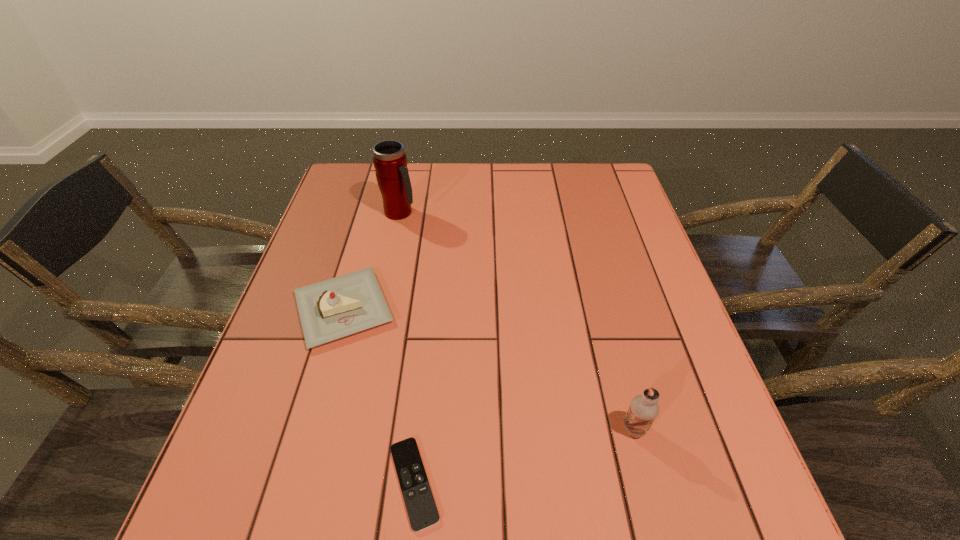
I want to click on vacant space positioned on the front of the third tallest object, so click(299, 465).

Where is `free space located 0.120m on the right of the remote control`? The height and width of the screenshot is (540, 960). free space located 0.120m on the right of the remote control is located at coordinates (512, 483).

Identify the location of object that is positioned at the far edge. This screenshot has height=540, width=960. (390, 162).

Identify the location of object that is at the near edge. The height and width of the screenshot is (540, 960). (422, 511).

Locate an element on the screen. object at the left edge is located at coordinates (338, 307).

Locate an element on the screen. Image resolution: width=960 pixels, height=540 pixels. object present at the right edge is located at coordinates click(x=643, y=409).

Locate an element on the screen. free space at the far edge of the desktop is located at coordinates (433, 186).

You are a GUI agent. You are given a task and a screenshot of the screen. Output one action in this format:
    pyautogui.click(x=<x>, y=<y>)
    Task: Click on the free space at the near edge of the desktop
    The width and height of the screenshot is (960, 540).
    Given the screenshot: What is the action you would take?
    pyautogui.click(x=444, y=483)

This screenshot has height=540, width=960. I want to click on vacant area at the left edge, so click(x=324, y=235).

This screenshot has width=960, height=540. What are the coordinates of `free space at the right edge of the desktop` in the screenshot? It's located at (627, 275).